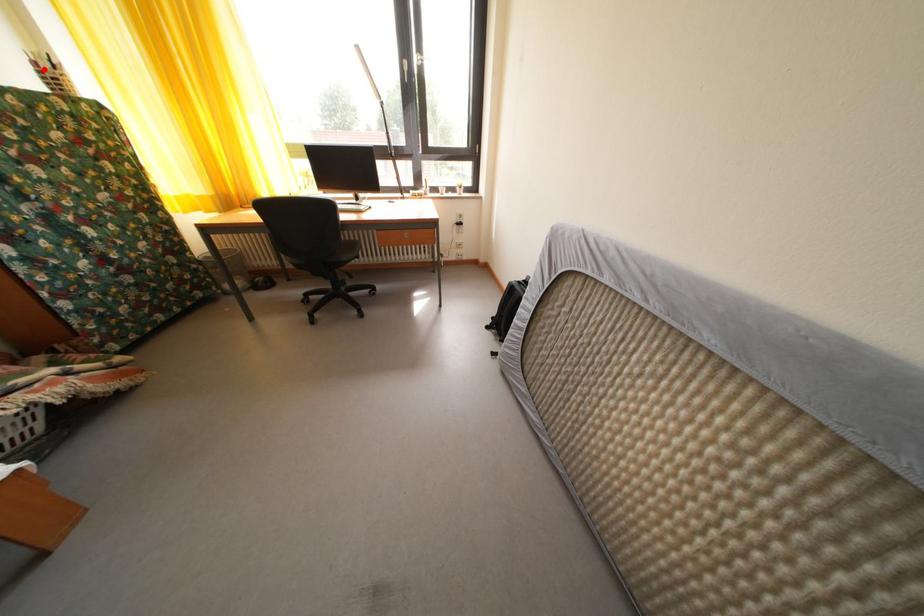
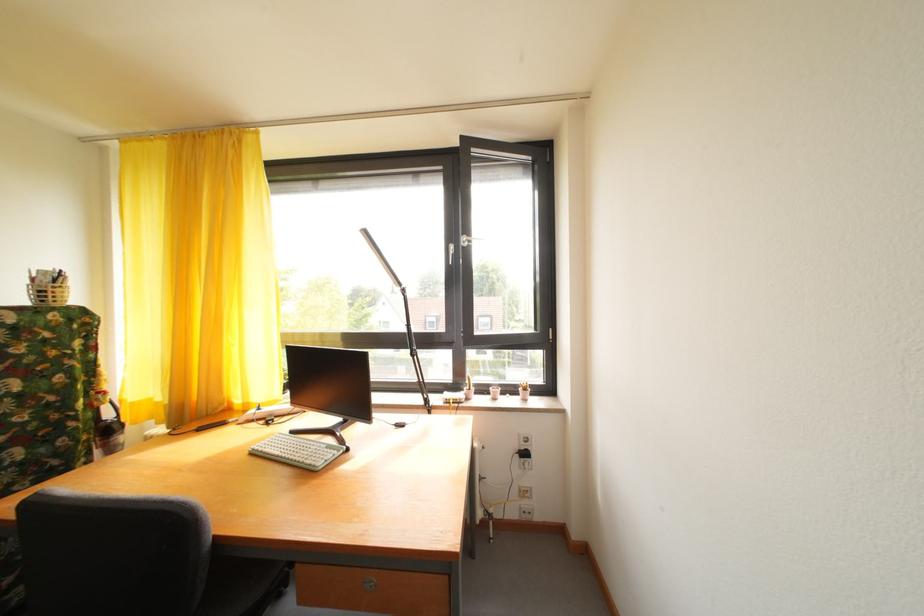
Locate, in the second image, the point that corresponds to the highlighted location in the first image.

(43, 286)